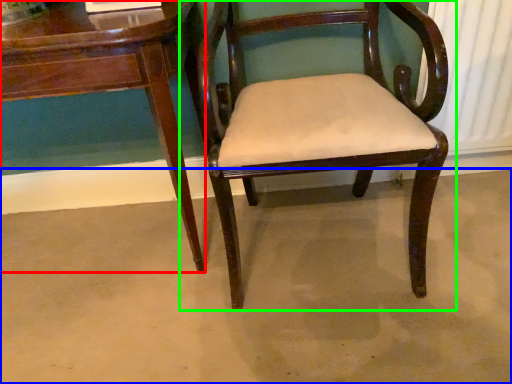
Question: Which is nearer to the table (highlighted by a red box)? concrete (highlighted by a blue box) or chair (highlighted by a green box).

Choices:
 (A) concrete
 (B) chair

Answer: (B)